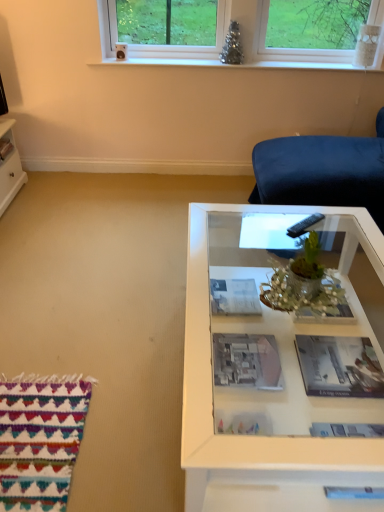
Image resolution: width=384 pixels, height=512 pixels. Find the location of `white glass table at center`. white glass table at center is located at coordinates (279, 365).

What do you see at coordinates (279, 365) in the screenshot? I see `white glass table at center` at bounding box center [279, 365].

The image size is (384, 512). Identify the location of matte gray magazine at lower right, marked as the second magazine in a left-to-right arrangement. (339, 366).

The height and width of the screenshot is (512, 384). Find the location of `black plastic remote at center`. black plastic remote at center is located at coordinates (304, 225).

From the image's perspective, is clear glass window at upper center positioned above or below matte gray magazine at lower right, the first magazine in the front-to-back sequence?

Clearly, from the image's perspective, clear glass window at upper center is above matte gray magazine at lower right, the first magazine in the front-to-back sequence.

Which is less distant, [141,12] or [332,384]?

The point [332,384] is more forward.

Does clear glass window at upper center have a greater width compared to matte gray magazine at lower right, which is counted as the 1th magazine, starting from the bottom?

Incorrect, the width of clear glass window at upper center does not surpass that of matte gray magazine at lower right, which is counted as the 1th magazine, starting from the bottom.

From a real-world perspective, who is located lower, clear glass window at upper center or matte gray magazine at lower right, which is counted as the first magazine, starting from the right?

matte gray magazine at lower right, which is counted as the first magazine, starting from the right.

In the scene shown: Is matte gray book at center, which is counted as the 1th book, starting from the bottom, at the back of clear glass window at upper center?

No, clear glass window at upper center's orientation is not away from matte gray book at center, which is counted as the 1th book, starting from the bottom.

Looking at this image, is matte gray book at center, which appears as the second book when viewed from the left, a part of clear glass window at upper center?

No, matte gray book at center, which appears as the second book when viewed from the left, is not surrounded by clear glass window at upper center.

Between clear glass window at upper center and matte gray book at center, the second book positioned from the top, which one appears on the left side from the viewer's perspective?

Positioned to the left is matte gray book at center, the second book positioned from the top.

Identify the location of window above the matte gray book at center, which is counted as the 1th book, starting from the bottom (from the image's perspective). Image resolution: width=384 pixels, height=512 pixels. (314, 33).

You are a GUI agent. You are given a task and a screenshot of the screen. Output one action in this format:
    pyautogui.click(x=<x>, y=<y>)
    Task: Click on the book behind the matte paper magazine at center, which ranks as the first magazine in back-to-front order
    This screenshot has width=384, height=512.
    Given the screenshot: What is the action you would take?
    pyautogui.click(x=5, y=148)

From the image's perspective, is matte paper magazine at center, which is counted as the 2th magazine, starting from the front, located above or below matte black book at lower left, the second book when ordered from front to back?

Based on their image positions, matte paper magazine at center, which is counted as the 2th magazine, starting from the front, is located beneath matte black book at lower left, the second book when ordered from front to back.

Which of these two, matte paper magazine at center, which is the 2th magazine in right-to-left order, or matte black book at lower left, which is counted as the second book, starting from the right, stands taller?

Standing taller between the two is matte black book at lower left, which is counted as the second book, starting from the right.

Can you confirm if matte paper magazine at center, which is the 2th magazine in right-to-left order, is positioned to the left of matte black book at lower left, which ranks as the first book in back-to-front order?

No, matte paper magazine at center, which is the 2th magazine in right-to-left order, is not to the left of matte black book at lower left, which ranks as the first book in back-to-front order.

How different are the orientations of matte gray magazine at lower right, the 2th magazine in the top-to-bottom sequence, and white glass table at center in degrees?

The angular difference between matte gray magazine at lower right, the 2th magazine in the top-to-bottom sequence, and white glass table at center is 1 degrees.

Is matte gray magazine at lower right, marked as the second magazine in a left-to-right arrangement, situated inside white glass table at center or outside?

matte gray magazine at lower right, marked as the second magazine in a left-to-right arrangement, is enclosed within white glass table at center.

Does matte gray magazine at lower right, the 2th magazine in the top-to-bottom sequence, have a greater height compared to white glass table at center?

Incorrect, the height of matte gray magazine at lower right, the 2th magazine in the top-to-bottom sequence, is not larger of that of white glass table at center.

Based on the photo, from the image's perspective, who appears lower, matte gray magazine at lower right, the 2th magazine in the top-to-bottom sequence, or white glass table at center?

matte gray magazine at lower right, the 2th magazine in the top-to-bottom sequence, is shown below in the image.

Locate an element on the screen. This screenshot has height=512, width=384. the 1st book behind the white glass table at center, starting your count from the anchor is located at coordinates (247, 361).

In the scene shown: Is white glass table at center not near matte gray book at center, marked as the 1th book in a front-to-back arrangement?

white glass table at center is actually quite close to matte gray book at center, marked as the 1th book in a front-to-back arrangement.

Is matte gray book at center, which appears as the second book when viewed from the left, inside white glass table at center?

No, matte gray book at center, which appears as the second book when viewed from the left, is not inside white glass table at center.

Does white glass table at center have a lesser width compared to matte gray book at center, which is counted as the 1th book, starting from the bottom?

Incorrect, the width of white glass table at center is not less than that of matte gray book at center, which is counted as the 1th book, starting from the bottom.

Can you confirm if black plastic remote at center is thinner than matte gray book at center, the second book positioned from the top?

Yes, black plastic remote at center is thinner than matte gray book at center, the second book positioned from the top.

Is black plastic remote at center far from matte gray book at center, positioned as the first book in right-to-left order?

They are positioned close to each other.

From the image's perspective, is black plastic remote at center positioned above or below matte gray book at center, which is counted as the 2th book, starting from the back?

black plastic remote at center is situated higher than matte gray book at center, which is counted as the 2th book, starting from the back, in the image.

Considering the sizes of objects matte black book at lower left, which is counted as the first book, starting from the top, and matte paper magazine at center, which is counted as the 2th magazine, starting from the front, in the image provided, who is taller, matte black book at lower left, which is counted as the first book, starting from the top, or matte paper magazine at center, which is counted as the 2th magazine, starting from the front,?

matte black book at lower left, which is counted as the first book, starting from the top, is taller.

Is matte black book at lower left, the second book when ordered from front to back, looking in the opposite direction of matte paper magazine at center, which is counted as the 2th magazine, starting from the front?

matte black book at lower left, the second book when ordered from front to back, does not have its back to matte paper magazine at center, which is counted as the 2th magazine, starting from the front.

Which object is further away from the camera taking this photo, matte black book at lower left, the second book when ordered from front to back, or matte paper magazine at center, which is the 2th magazine in right-to-left order?

matte black book at lower left, the second book when ordered from front to back, is behind.

I want to click on window behind the matte gray magazine at lower right, which is counted as the 1th magazine, starting from the bottom, so click(314, 33).

Identify the location of window located above the matte gray book at center, marked as the 1th book in a front-to-back arrangement (from the image's perspective). This screenshot has width=384, height=512. (314, 33).

From the image, which object appears to be nearer to clear glass window at upper center, matte paper magazine at center, the second magazine from the bottom, or white glass table at center?

matte paper magazine at center, the second magazine from the bottom, is positioned closer to the anchor clear glass window at upper center.

Estimate the real-world distances between objects in this image. Which object is closer to matte paper magazine at center, the second magazine from the bottom, matte gray magazine at lower right, the first magazine in the front-to-back sequence, or white glass table at center?

white glass table at center lies closer to matte paper magazine at center, the second magazine from the bottom, than the other object.

Estimate the real-world distances between objects in this image. Which object is further from white glass table at center, matte black book at lower left, the 1th book positioned from the left, or matte gray magazine at lower right, which is counted as the 1th magazine, starting from the bottom?

The object further to white glass table at center is matte black book at lower left, the 1th book positioned from the left.

From the image, which object appears to be farther from matte gray book at center, positioned as the first book in right-to-left order, clear glass window at upper center or matte gray magazine at lower right, the 2th magazine in the top-to-bottom sequence?

clear glass window at upper center is positioned further to the anchor matte gray book at center, positioned as the first book in right-to-left order.

Looking at the image, which one is located closer to white glass table at center, matte gray magazine at lower right, the first magazine in the front-to-back sequence, or matte black book at lower left, the 2th book positioned from the bottom?

matte gray magazine at lower right, the first magazine in the front-to-back sequence, is positioned closer to the anchor white glass table at center.

When comparing their distances from clear glass window at upper center, does matte gray book at center, positioned as the first book in right-to-left order, or black plastic remote at center seem further?

matte gray book at center, positioned as the first book in right-to-left order, is further to clear glass window at upper center.

Which object lies nearer to the anchor point matte gray book at center, positioned as the first book in right-to-left order, matte black book at lower left, the 1th book positioned from the left, or white glass table at center?

Based on the image, white glass table at center appears to be nearer to matte gray book at center, positioned as the first book in right-to-left order.

Estimate the real-world distances between objects in this image. Which object is closer to matte gray book at center, the second book positioned from the top, matte gray magazine at lower right, the first magazine in the front-to-back sequence, or matte black book at lower left, which ranks as the first book in back-to-front order?

matte gray magazine at lower right, the first magazine in the front-to-back sequence, is positioned closer to the anchor matte gray book at center, the second book positioned from the top.

Identify the location of window between matte black book at lower left, which is counted as the first book, starting from the top, and matte gray magazine at lower right, the first magazine in the front-to-back sequence, in the horizontal direction. The image size is (384, 512). click(314, 33).

Image resolution: width=384 pixels, height=512 pixels. What are the coordinates of `remote between clear glass window at upper center and matte paper magazine at center, which is counted as the 2th magazine, starting from the front, in the vertical direction` in the screenshot? It's located at (304, 225).

Locate an element on the screen. The height and width of the screenshot is (512, 384). magazine between white glass table at center and matte gray book at center, which is counted as the 1th book, starting from the bottom, along the z-axis is located at coordinates point(339,366).

I want to click on remote between white glass table at center and clear glass window at upper center along the z-axis, so click(x=304, y=225).